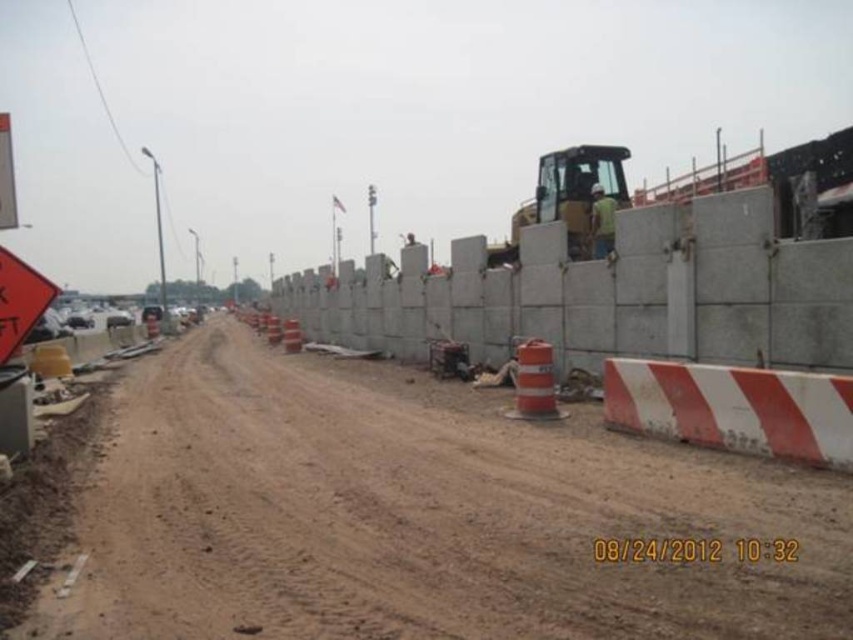
You are a construction inspector who needs to assess the accessibility of the brown dirt track at center for a delivery truck. Considering the presence of the green fabric construction worker at center, can you determine if the track is wide enough for the truck to pass safely?

The brown dirt track at center is wider than the green fabric construction worker at center, so the track should be wide enough for the delivery truck to pass safely.

You are standing at the center of the dirt road in the construction site. You notice a point marked at coordinates (422, 516). What does this point represent?

The point at coordinates (422, 516) corresponds to the brown dirt track at center.